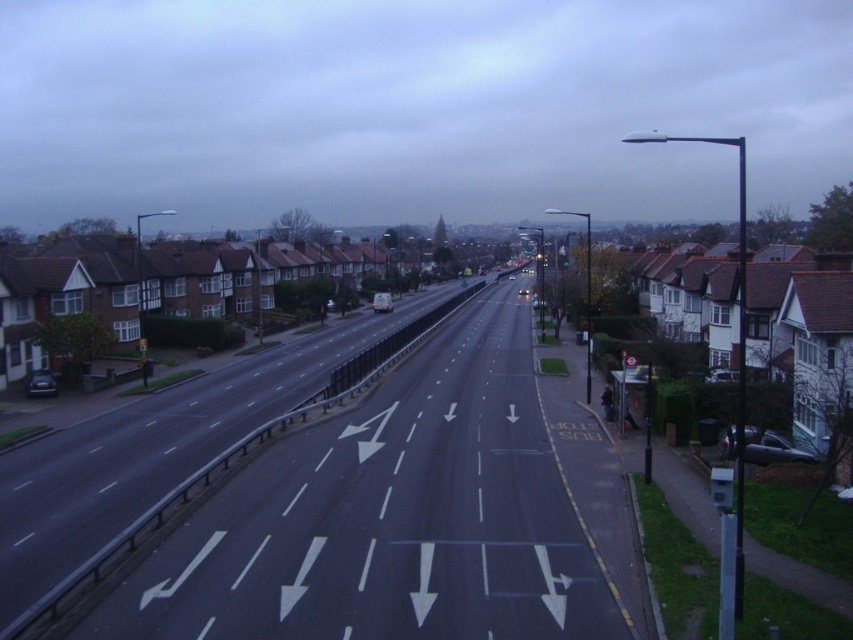
You are a pedestrian standing at the bus stop sign near the sidewalk on the right side of the road. You want to cross to the other side of the road to reach a store located near the houses on the left. The road has a speed limit of 50 km per hour. Considering the distance between the black asphalt highway at center and the matte black car at left, do you think it is safe to cross the road at this point?

The distance between the black asphalt highway at center and the matte black car at left is 16.46 meters. Since the car is 16.46 meters away from the center of the road, it would take approximately 6 seconds to reach the crossing point at 50 km per hour. This provides sufficient time for a pedestrian to cross the road safely, assuming no other vehicles are approaching from the opposite direction.

You are driving a metallic silver car at center and want to overtake the metallic silver car at right. Given that the distance between them is 31.02 feet, is there enough space to safely perform a lane change without cutting off the other vehicle?

The metallic silver car at right is 31.02 feet away from the metallic silver car at center. To safely overtake, ensure that the distance allows for a smooth lane change without interfering with the other vehicle. A distance of 31.02 feet is generally sufficient for a safe maneuver if speeds are appropriate and road conditions permit.